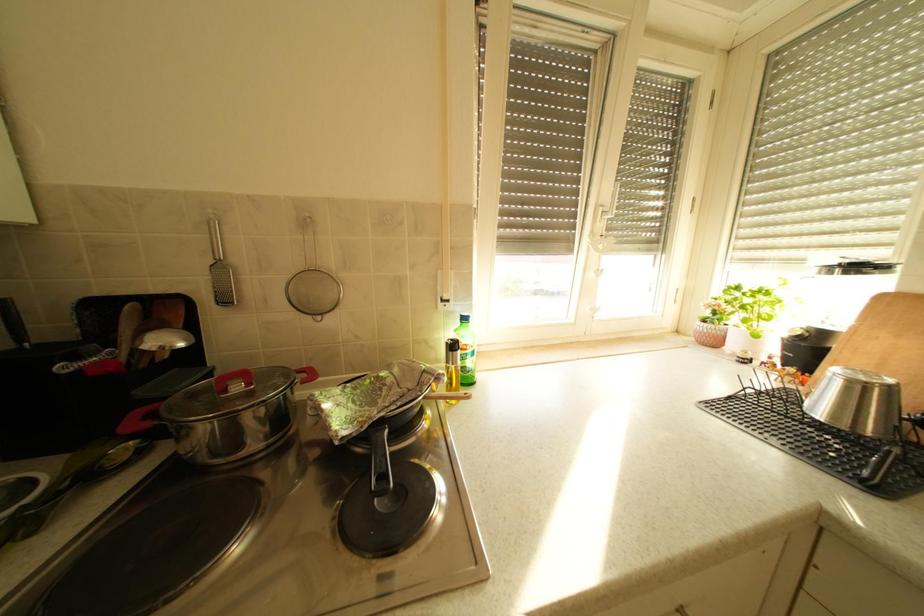
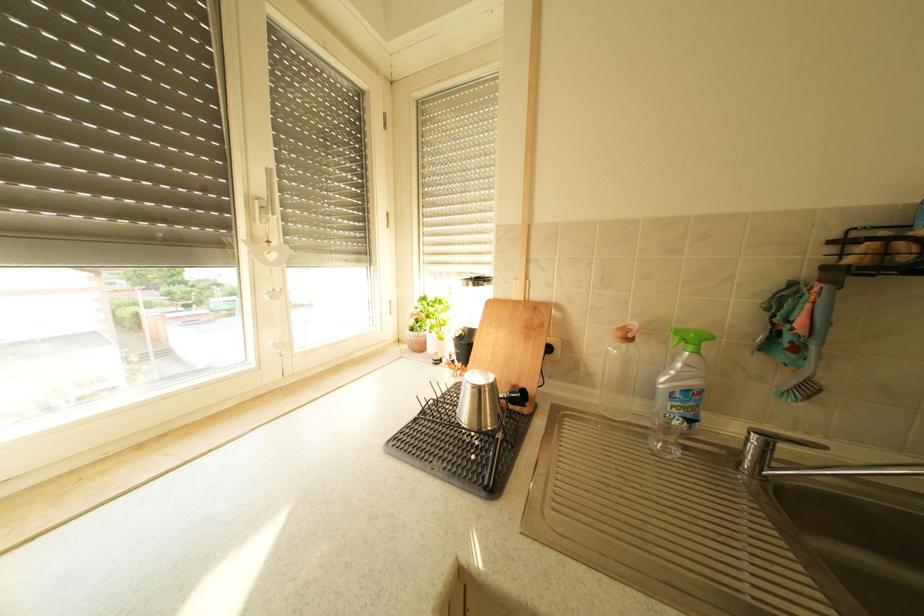
Question: The camera is either moving clockwise (left) or counter-clockwise (right) around the object. The first image is from the beginning of the video and the second image is from the end. Is the camera moving left or right when shooting the video?

Choices:
 (A) Left
 (B) Right

Answer: (A)